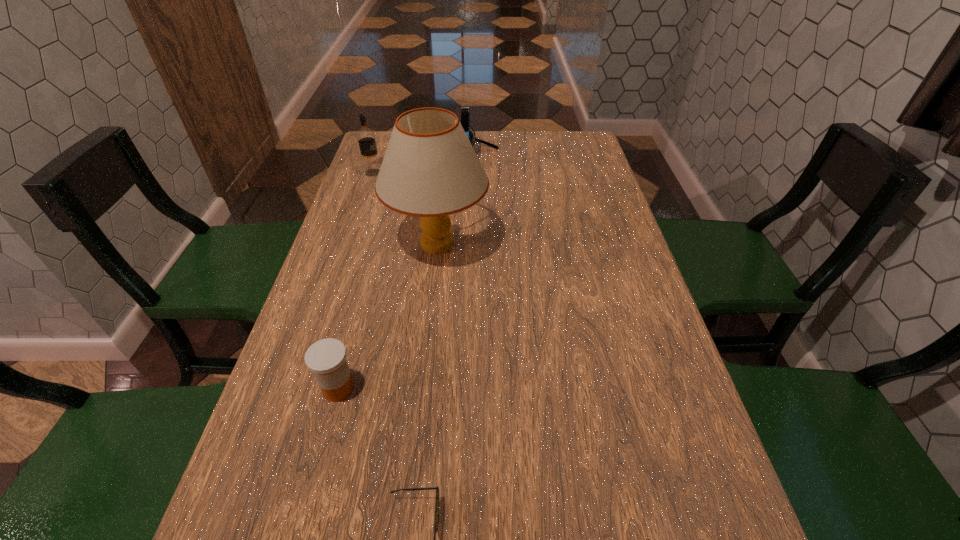
At what (x,y) coordinates should I click in order to perform the action: click on object that is at the far edge. Please return your answer as a coordinate pair (x, y). This screenshot has height=540, width=960. Looking at the image, I should click on 465,110.

Where is `lampshade that is at the left edge`? This screenshot has height=540, width=960. lampshade that is at the left edge is located at coordinates (430, 170).

This screenshot has height=540, width=960. In order to click on vodka positioned at the left edge in this screenshot , I will do `click(366, 137)`.

You are a GUI agent. You are given a task and a screenshot of the screen. Output one action in this format:
    pyautogui.click(x=<x>, y=<y>)
    Task: Click on the medicine that is at the left edge
    The image size is (960, 540).
    Given the screenshot: What is the action you would take?
    point(326,358)

Where is `vacant space at the far edge of the desktop`? vacant space at the far edge of the desktop is located at coordinates (517, 135).

The image size is (960, 540). Identify the location of blank area at the left edge. (369, 268).

Identify the location of free region at the right edge. (582, 168).

Identify the location of vacant space in between the headset and the second nearest object. The height and width of the screenshot is (540, 960). (408, 274).

Where is `vacant space that is in between the tallest object and the fourth farthest object`? The width and height of the screenshot is (960, 540). vacant space that is in between the tallest object and the fourth farthest object is located at coordinates coord(388,316).

Image resolution: width=960 pixels, height=540 pixels. I want to click on free spot between the second shortest object and the tallest object, so click(x=388, y=316).